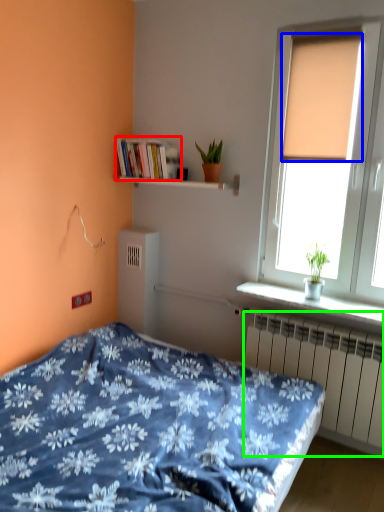
Question: Which object is the farthest from book (highlighted by a red box)? Choose among these: curtain (highlighted by a blue box) or radiator (highlighted by a green box).

Choices:
 (A) curtain
 (B) radiator

Answer: (B)